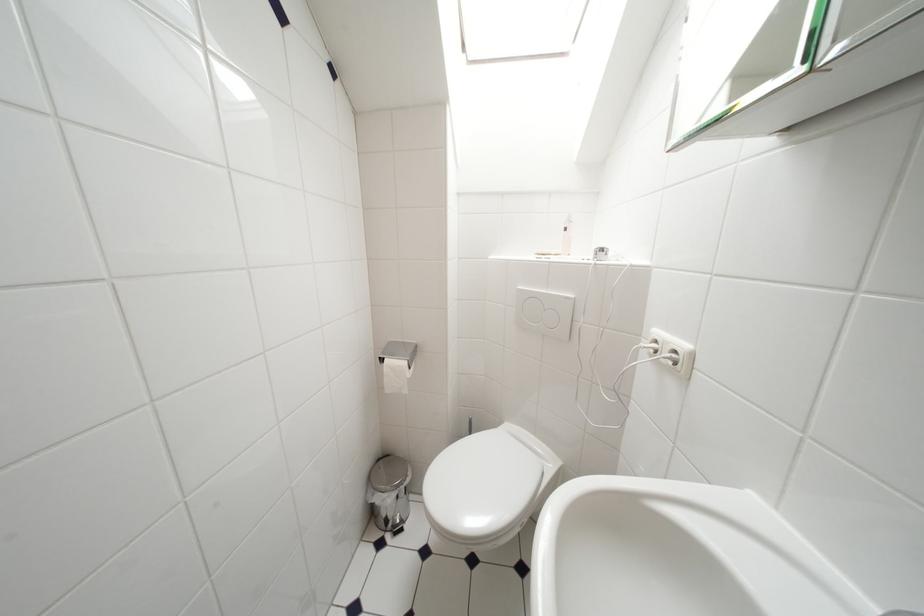
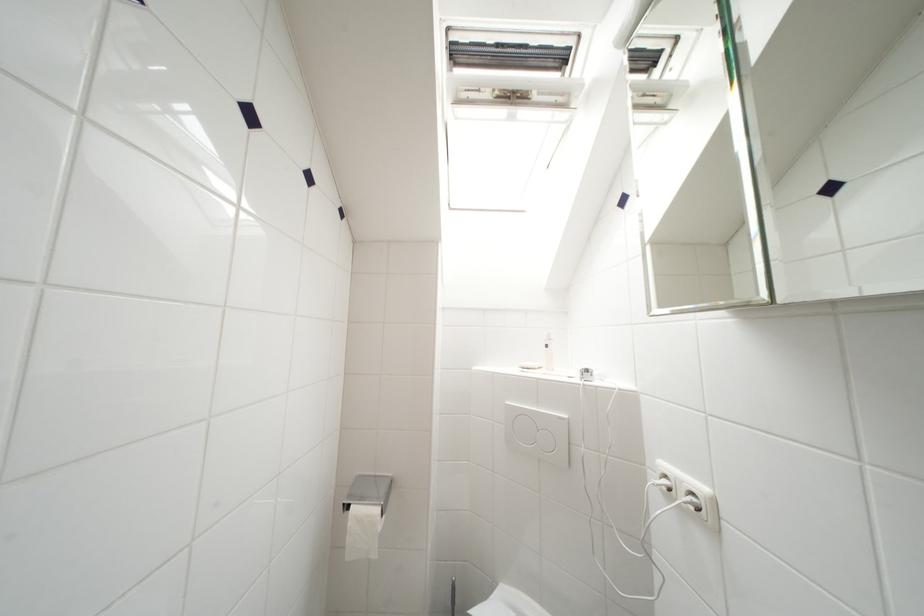
Question: The images are taken continuously from a first-person perspective. In which direction are you moving?

Choices:
 (A) Left
 (B) Right
 (C) Forward
 (D) Backward

Answer: (A)